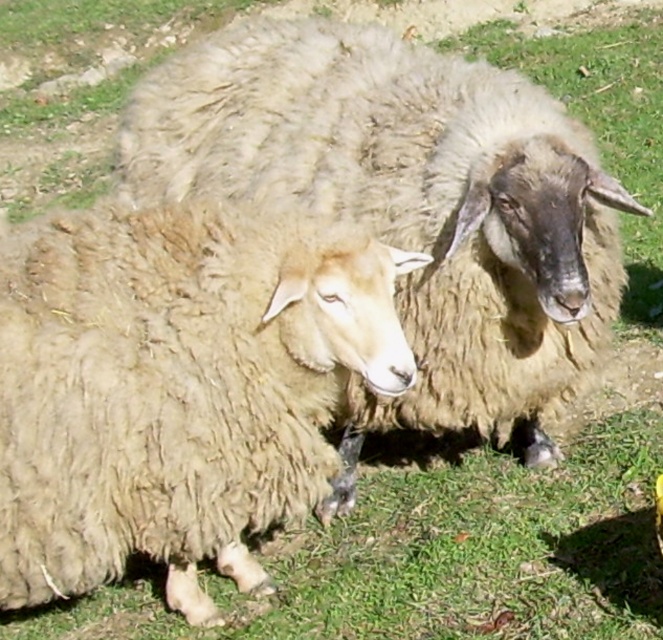
Is fuzzy beige wool at center to the left of fuzzy woolen sheep at center from the viewer's perspective?

Yes, fuzzy beige wool at center is to the left of fuzzy woolen sheep at center.

Between point (109, 403) and point (332, 58), which one is positioned behind?

Positioned behind is point (332, 58).

Who is more forward, (243, 250) or (619, 266)?

Point (243, 250)

This screenshot has height=640, width=663. Find the location of `fuzzy beige wool at center`. fuzzy beige wool at center is located at coordinates (176, 387).